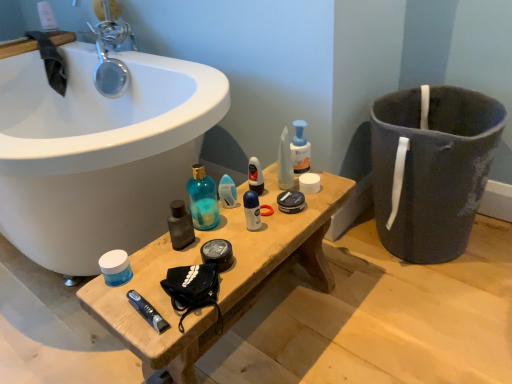
This screenshot has height=384, width=512. I want to click on free point below wooden bench at center (from a real-world perspective), so click(x=271, y=325).